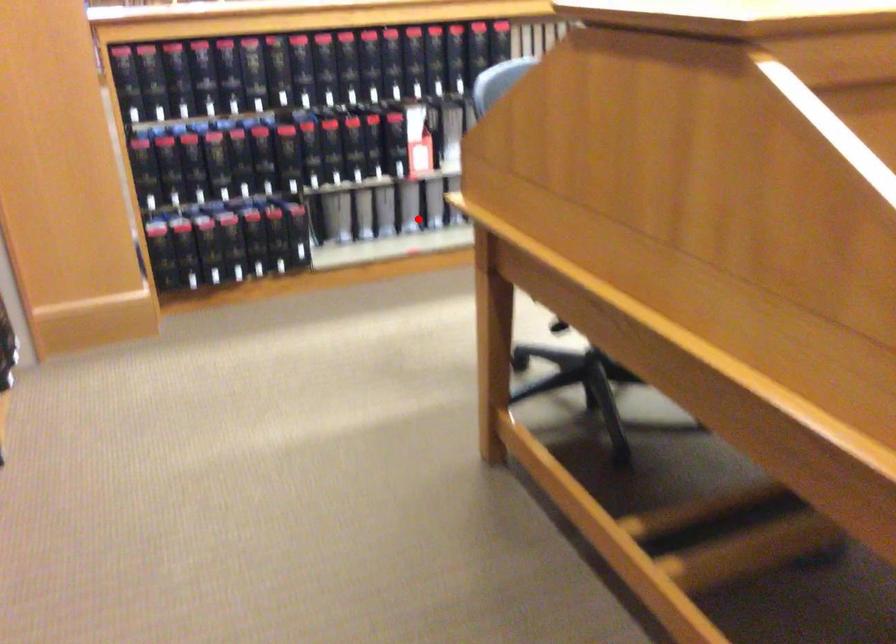
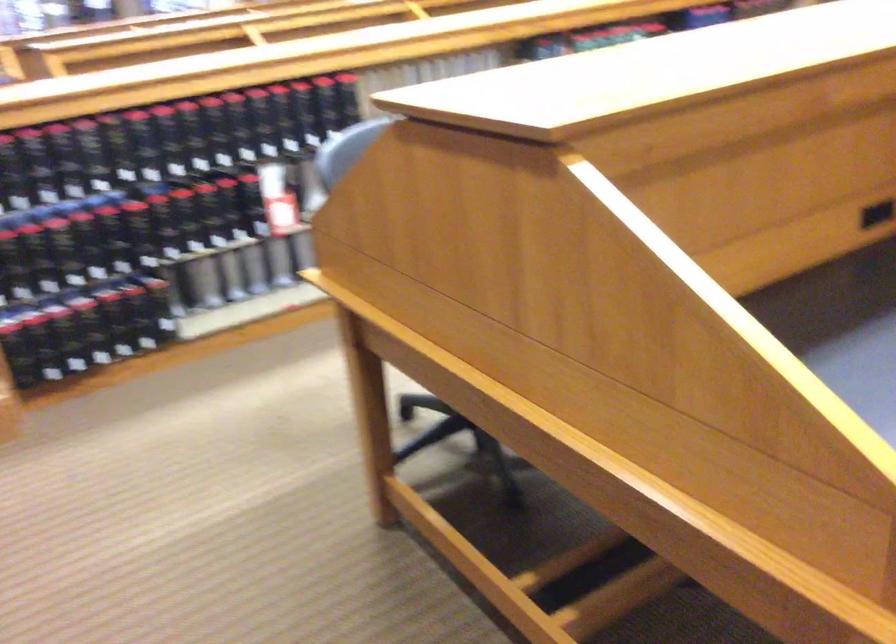
The point at the highlighted location is marked in the first image. Where is the corresponding point in the second image?

(288, 270)